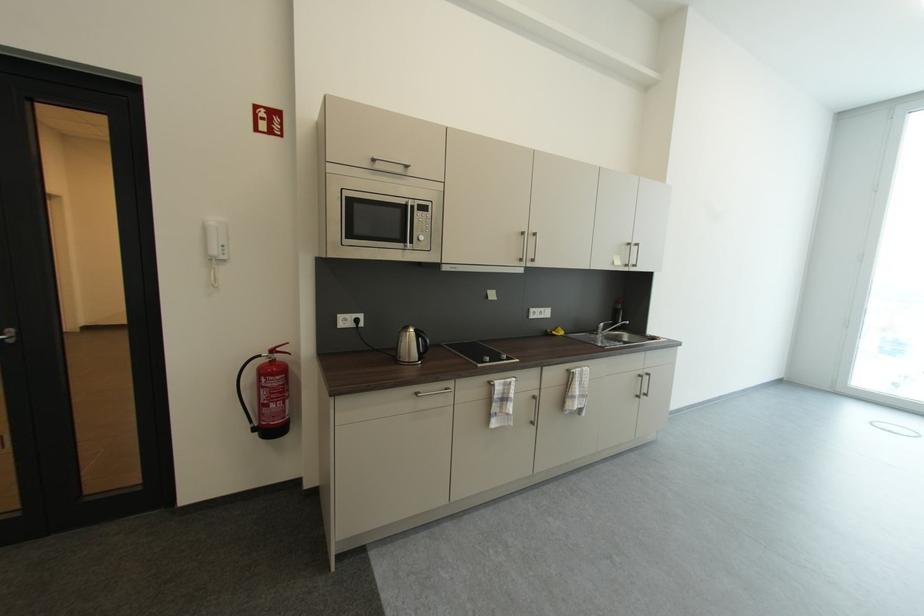
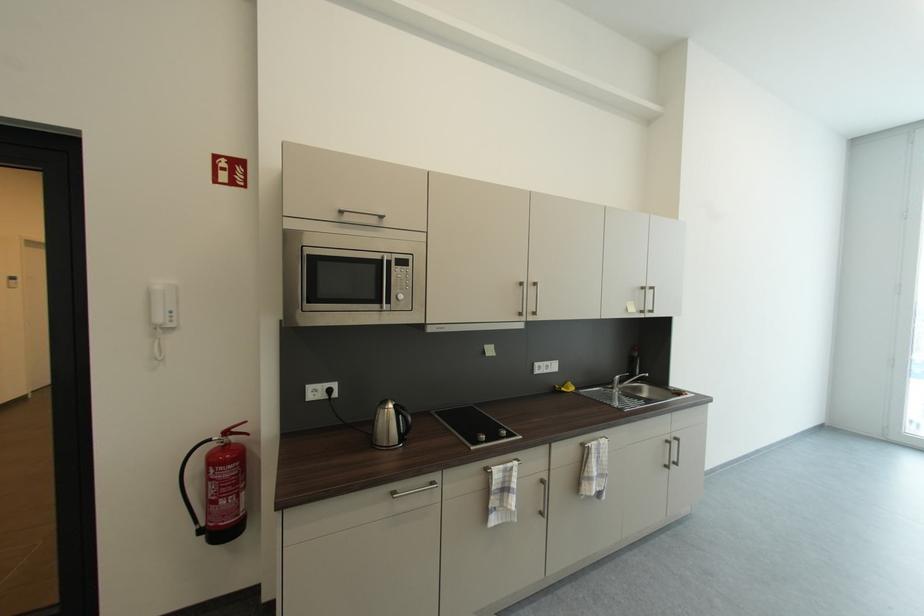
Locate, in the second image, the point that corresponds to (x=424, y=207) in the first image.

(403, 261)